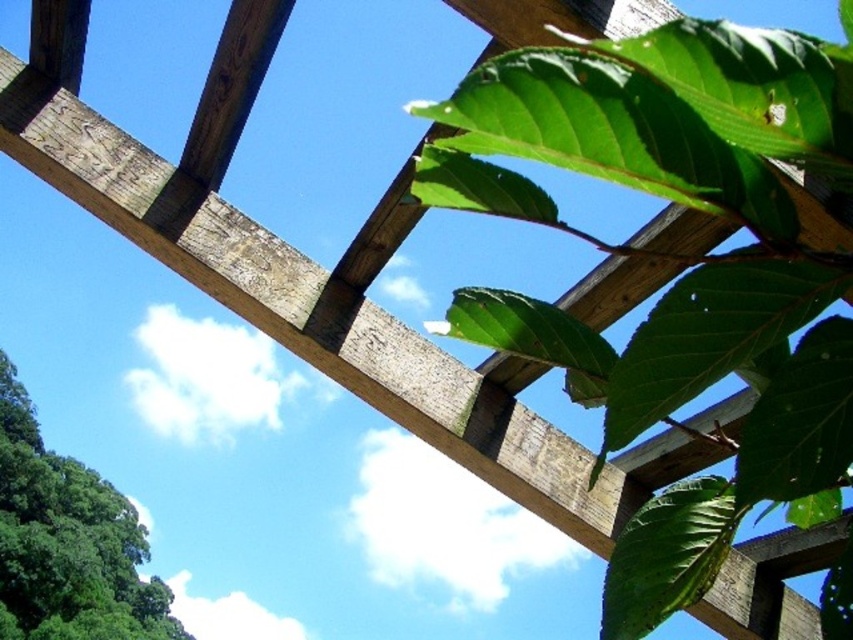
You are standing in the garden looking at the wooden pergola. You notice the green matte leaves at upper right and the green leafy tree at lower left. Which object is positioned higher in the scene?

The green matte leaves at upper right are positioned higher than the green leafy tree at lower left according to the description.

You are standing in the garden and want to take a photo of both the green matte leaves at upper right and the green leafy tree at lower left. Which object should you frame first in your camera viewfinder to ensure both are in the shot?

You should frame the green leafy tree at lower left first because the green matte leaves at upper right is to the right of it, so starting with the leftmost object ensures both are included in the frame.

You are a photographer trying to capture the wooden structure. You notice two points marked as point (x=682, y=60) and point (x=4, y=387). Which point should you focus on first if you want to ensure the closest part of the structure is in sharp focus?

Point (x=682, y=60) is closer to the camera than point (x=4, y=387), so you should focus on point (x=682, y=60) first to ensure the closest part of the structure is in sharp focus.